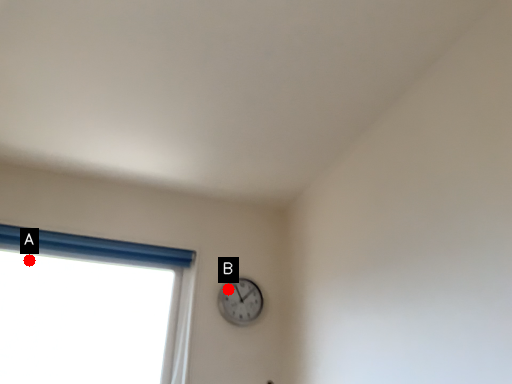
Question: Two points are circled on the image, labeled by A and B beside each circle. Which point is further to the camera?

Choices:
 (A) A is further
 (B) B is further

Answer: (B)